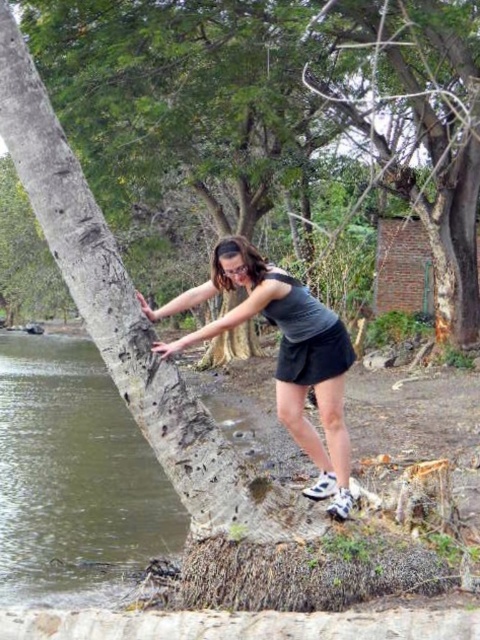
Which is below, rough bark tree at left or matte gray tank top at center?

matte gray tank top at center is below.

Looking at this image, is rough bark tree at left behind matte gray tank top at center?

Yes.

Does point (436, 246) come closer to viewer compared to point (327, 348)?

No, (436, 246) is further to viewer.

Where is `rough bark tree at left`? rough bark tree at left is located at coordinates (288, 92).